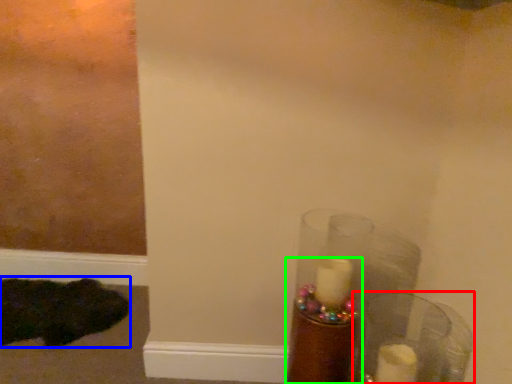
Question: Based on their relative distances, which object is nearer to glass vase (highlighted by a red box)? Choose from animal (highlighted by a blue box) and candle holder (highlighted by a green box).

Choices:
 (A) animal
 (B) candle holder

Answer: (B)